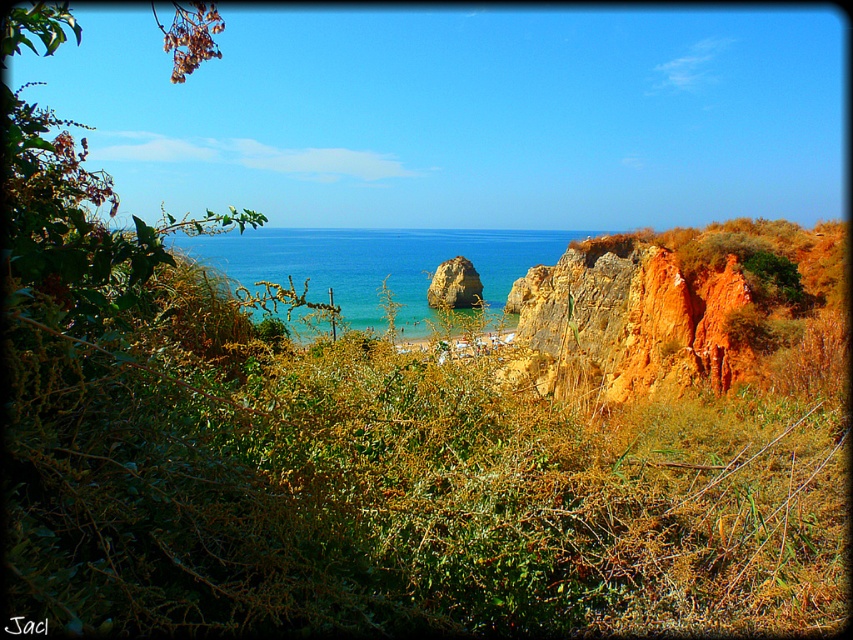
Question: Among these points, which one is nearest to the camera?

Choices:
 (A) (303, 241)
 (B) (460, 266)

Answer: (B)

Question: Which point is farther to the camera?

Choices:
 (A) (305, 256)
 (B) (467, 273)

Answer: (A)

Question: Is blue clear water at center smaller than orange rock at center?

Choices:
 (A) yes
 (B) no

Answer: (B)

Question: Which object appears closest to the camera in this image?

Choices:
 (A) orange rock at center
 (B) blue clear water at center

Answer: (B)

Question: Does blue clear water at center appear over orange rock at center?

Choices:
 (A) yes
 (B) no

Answer: (A)

Question: Is blue clear water at center above orange rock at center?

Choices:
 (A) yes
 (B) no

Answer: (A)